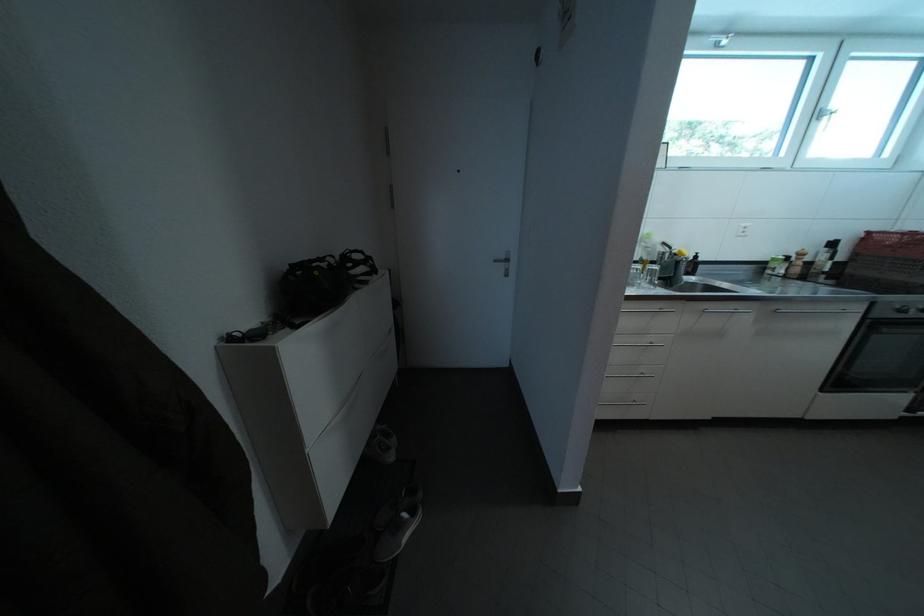
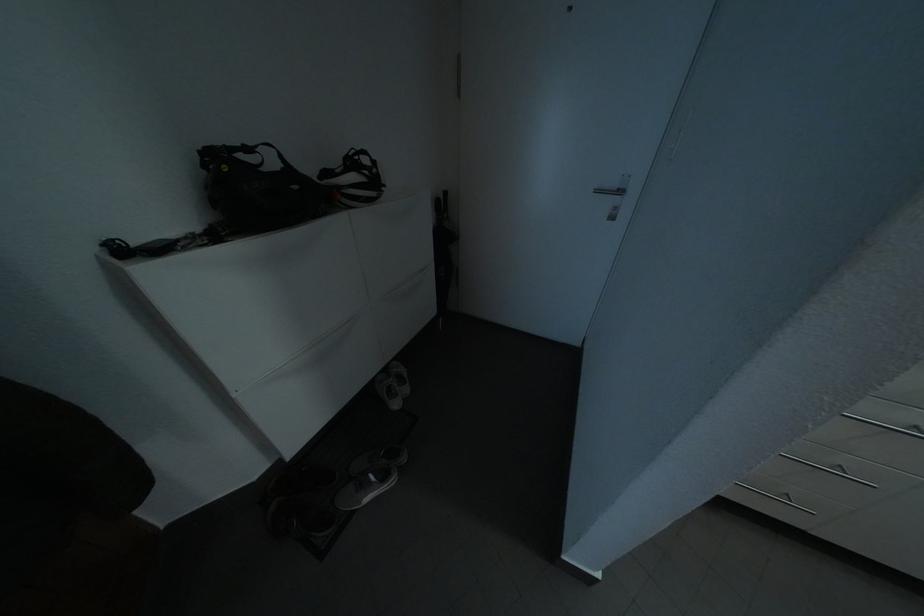
Locate, in the second image, the point that corresponds to the point at 422,517 in the first image.

(393, 483)